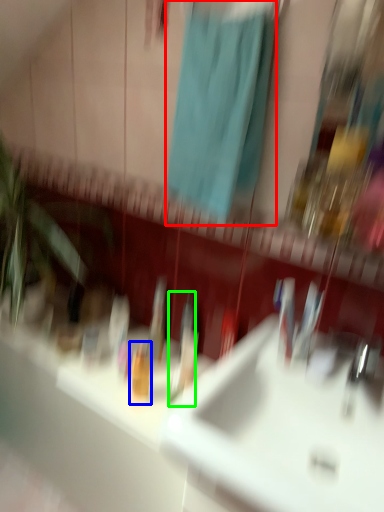
Question: Which object is positioned farthest from shower curtain (highlighted by a red box)? Select from toiletry (highlighted by a blue box) and toothbrush (highlighted by a green box).

Choices:
 (A) toiletry
 (B) toothbrush

Answer: (A)